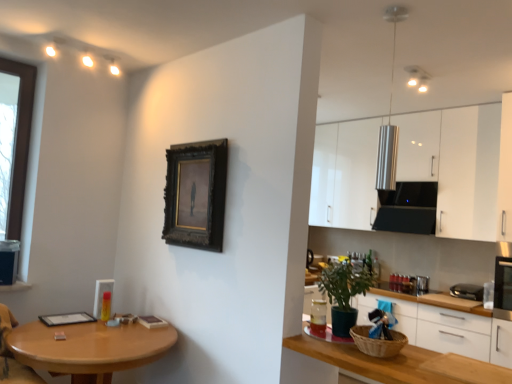
The image size is (512, 384). In order to click on free space above wooden table at lower left (from a real-world perspective) in this screenshot , I will do `click(85, 333)`.